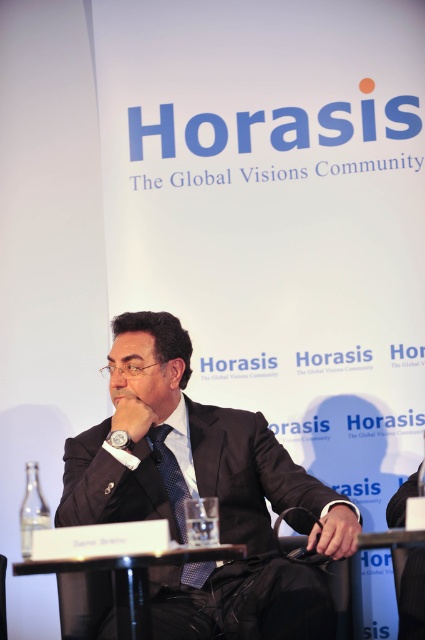
Question: Which of the following is the closest to the observer?

Choices:
 (A) (167, 445)
 (B) (124, 572)

Answer: (B)

Question: Estimate the real-world distances between objects in this image. Which object is farther from the dark blue textured tie at center?

Choices:
 (A) black plastic table at lower center
 (B) dark gray suit at center

Answer: (A)

Question: Is dark gray suit at center smaller than dark blue textured tie at center?

Choices:
 (A) yes
 (B) no

Answer: (B)

Question: Does dark gray suit at center come in front of black plastic table at lower center?

Choices:
 (A) yes
 (B) no

Answer: (B)

Question: In this image, where is dark gray suit at center located relative to dark blue textured tie at center?

Choices:
 (A) above
 (B) below

Answer: (A)

Question: Which point is closer to the camera?

Choices:
 (A) (107, 598)
 (B) (184, 502)
 (C) (263, 424)

Answer: (B)